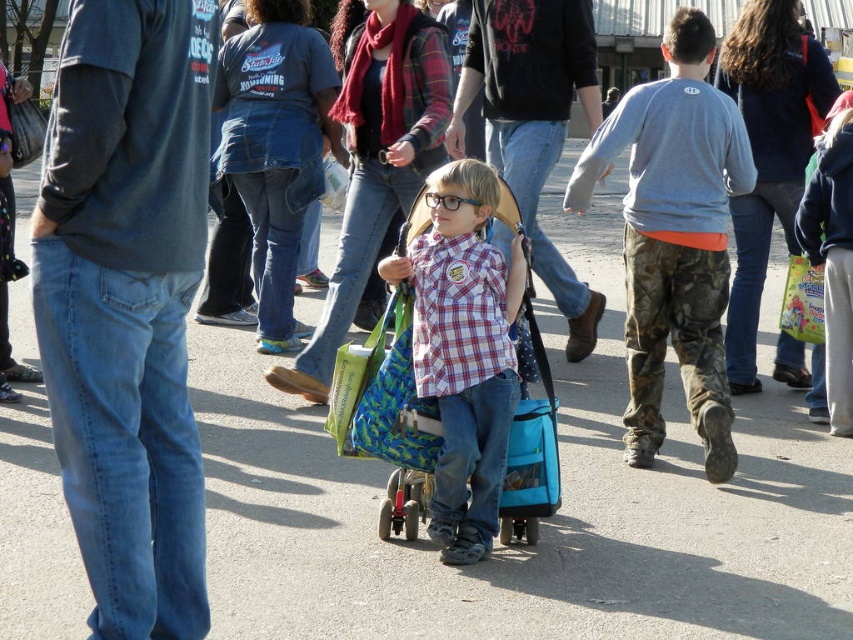
Question: Is the position of camouflage pants at right less distant than that of plaid cotton shirt at center?

Choices:
 (A) yes
 (B) no

Answer: (B)

Question: Can you confirm if camouflage pants at right is positioned to the right of plaid cotton shirt at center?

Choices:
 (A) no
 (B) yes

Answer: (B)

Question: Can you confirm if camouflage pants at right is bigger than plaid cotton shirt at center?

Choices:
 (A) yes
 (B) no

Answer: (A)